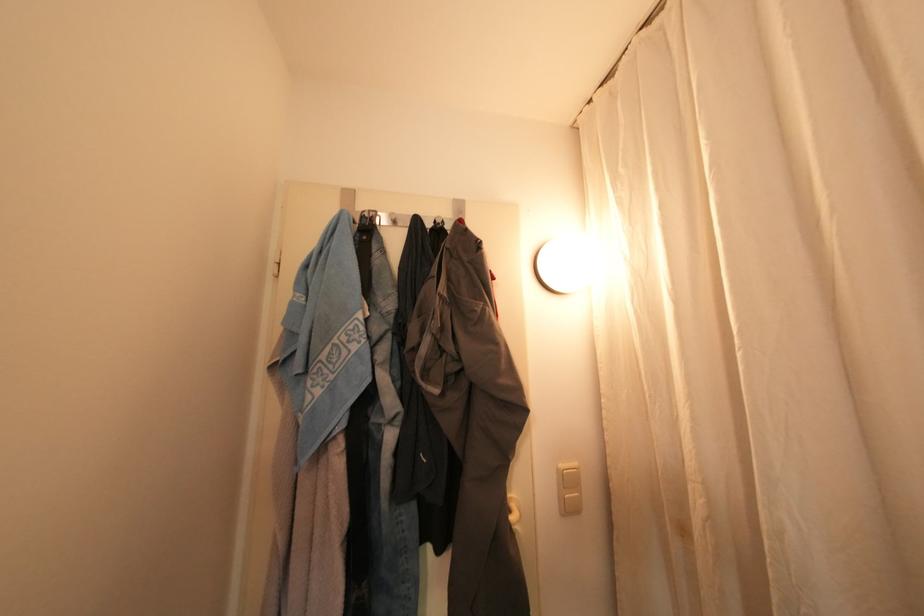
What do you see at coordinates (569, 488) in the screenshot? I see `a white light switch` at bounding box center [569, 488].